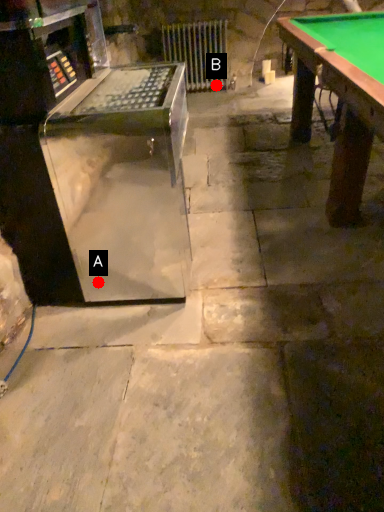
Question: Two points are circled on the image, labeled by A and B beside each circle. Which point is farther from the camera taking this photo?

Choices:
 (A) A is further
 (B) B is further

Answer: (B)